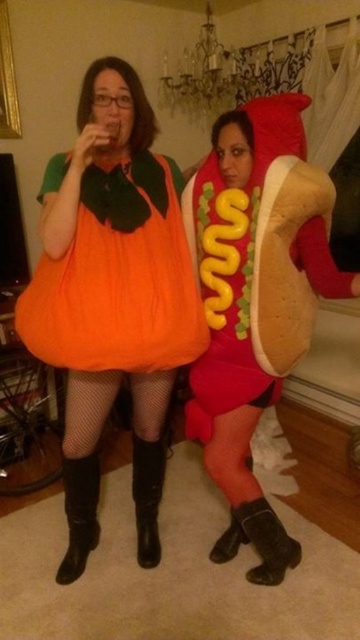
Question: Which point appears farthest from the camera in this image?

Choices:
 (A) (97, 522)
 (B) (153, 317)
 (C) (169, 376)

Answer: (A)

Question: Which point appears closest to the camera in this image?

Choices:
 (A) (194, 397)
 (B) (164, 365)
 (C) (90, 518)
 (D) (153, 566)

Answer: (B)

Question: Considering the relative positions of orange fabric pumpkin at center and black leather boot at lower left in the image provided, where is orange fabric pumpkin at center located with respect to black leather boot at lower left?

Choices:
 (A) below
 (B) above

Answer: (B)

Question: Does orange fabric pumpkin at center have a larger size compared to matte red hot dog at center?

Choices:
 (A) yes
 (B) no

Answer: (A)

Question: From the image, what is the correct spatial relationship of matte red hot dog at center in relation to black leather boot at lower left?

Choices:
 (A) left
 (B) right

Answer: (B)

Question: Which point appears farthest from the camera in this image?

Choices:
 (A) (101, 184)
 (B) (142, 467)

Answer: (B)